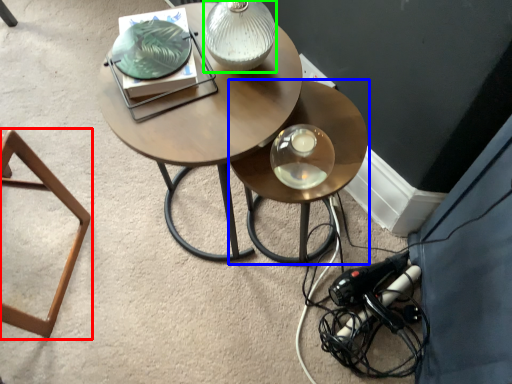
Question: Which object is positioned closest to stool (highlighted by a red box)? Select from table (highlighted by a blue box) and table lamp (highlighted by a green box).

Choices:
 (A) table
 (B) table lamp

Answer: (B)